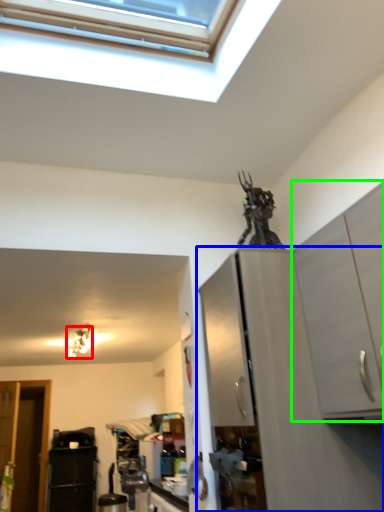
Question: Which is nearer to the light fixture (highlighted by a red box)? cabinetry (highlighted by a blue box) or cabinetry (highlighted by a green box).

Choices:
 (A) cabinetry
 (B) cabinetry

Answer: (A)